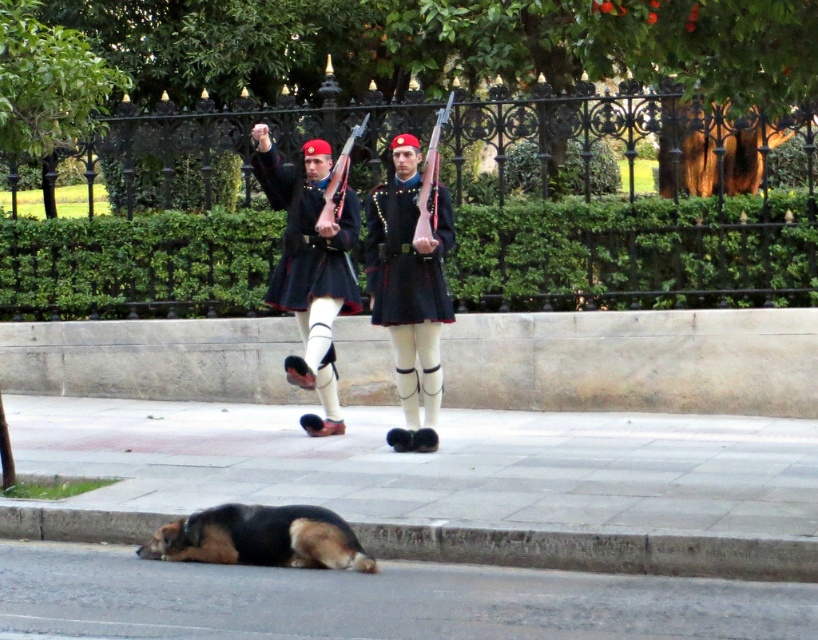
Which is in front, point (367, 248) or point (266, 147)?

Point (266, 147) is in front.

The width and height of the screenshot is (818, 640). Identify the location of dark blue uniform at center. (409, 289).

You are a GUI agent. You are given a task and a screenshot of the screen. Output one action in this format:
    pyautogui.click(x=<x>, y=<y>)
    Task: Click on the dark blue uniform at center
    This screenshot has height=640, width=818.
    Given the screenshot: What is the action you would take?
    point(409,289)

Is gray concrete curb at lower center wider than dark blue uniform at center?

Correct, the width of gray concrete curb at lower center exceeds that of dark blue uniform at center.

Find the location of `gray concrete curb at lower center`. gray concrete curb at lower center is located at coordinates (596, 550).

Does point (619, 582) come behind point (321, 156)?

No, (619, 582) is closer to viewer.

Between brown asphalt at lower center and matte black uniform at center, which one is positioned higher?

matte black uniform at center

The height and width of the screenshot is (640, 818). Identify the location of brown asphalt at lower center. (374, 600).

Find the location of a particular element. The width and height of the screenshot is (818, 640). brown asphalt at lower center is located at coordinates (374, 600).